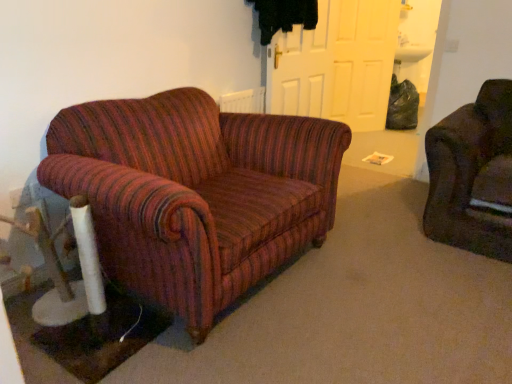
Question: From a real-world perspective, is white matte door at upper center, the first door from the right, physically located above or below white matte door at center, which appears as the second door when viewed from the back?

Choices:
 (A) above
 (B) below

Answer: (B)

Question: Is white matte door at upper center, which appears as the second door when viewed from the left, to the left or to the right of white matte door at center, the first door in the left-to-right sequence, in the image?

Choices:
 (A) right
 (B) left

Answer: (A)

Question: Considering the positions of point (316, 34) and point (291, 114), is point (316, 34) closer or farther from the camera than point (291, 114)?

Choices:
 (A) farther
 (B) closer

Answer: (A)

Question: Considering the positions of point (283, 102) and point (377, 44), is point (283, 102) closer or farther from the camera than point (377, 44)?

Choices:
 (A) closer
 (B) farther

Answer: (A)

Question: From the image's perspective, relative to white matte door at upper center, the 2th door positioned from the front, is white matte door at center, the first door in the left-to-right sequence, above or below?

Choices:
 (A) below
 (B) above

Answer: (A)

Question: From a real-world perspective, is white matte door at center, which is the first door from front to back, above or below white matte door at upper center, which appears as the second door when viewed from the left?

Choices:
 (A) above
 (B) below

Answer: (A)

Question: Would you say white matte door at center, which appears as the second door when viewed from the back, is inside or outside white matte door at upper center, the first door from the right?

Choices:
 (A) outside
 (B) inside

Answer: (A)